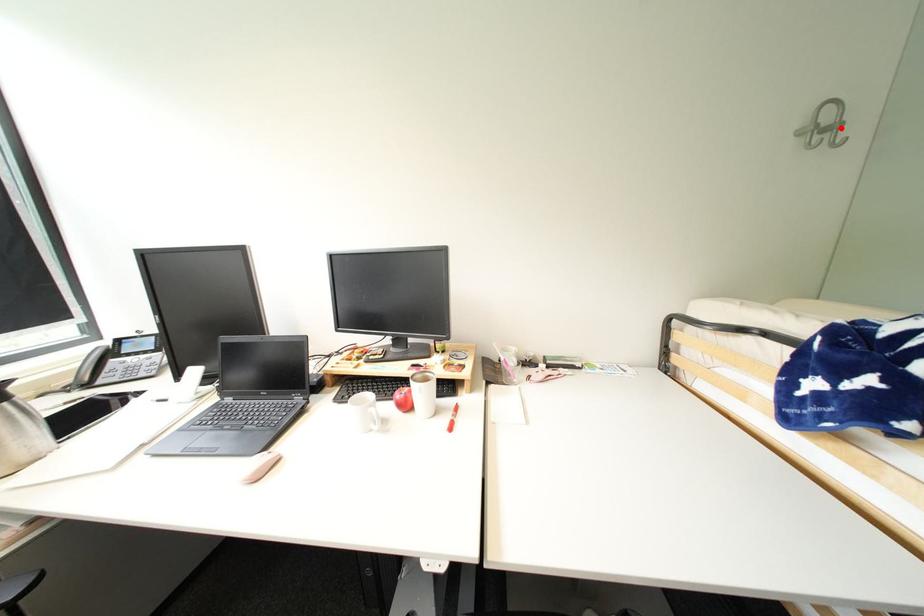
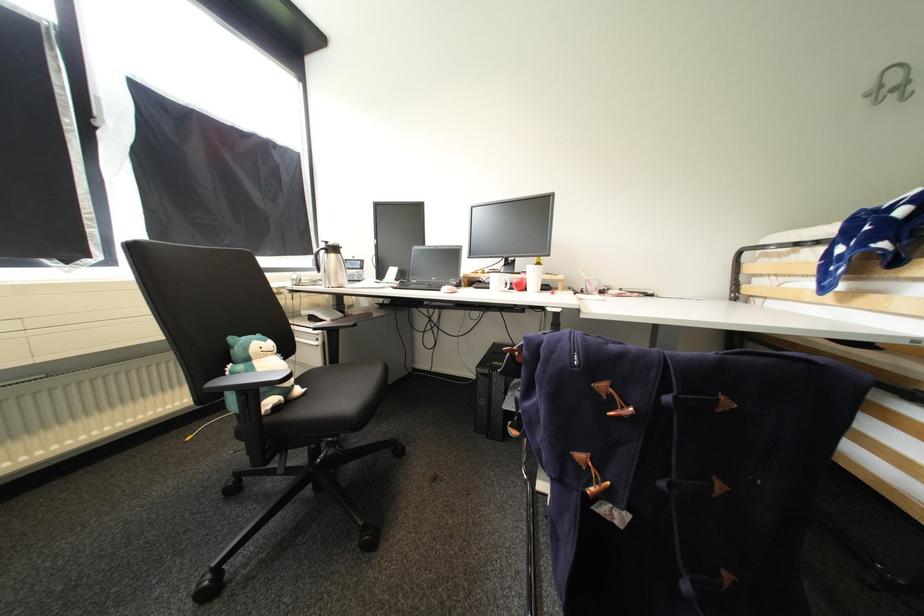
Locate, in the second image, the point that corresponds to the highlighted location in the first image.

(912, 84)